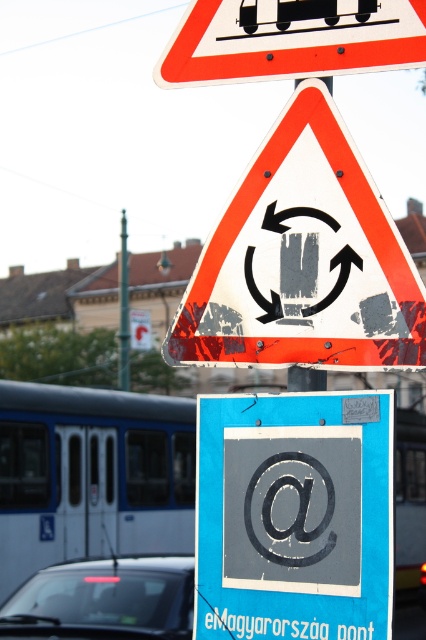
You are a delivery driver approaching a signpost with multiple traffic signs. You notice a point at coordinates point (294,516). What object is located at that point?

The point (294,516) indicates a gray matte symbol at center, which is an at symbol.